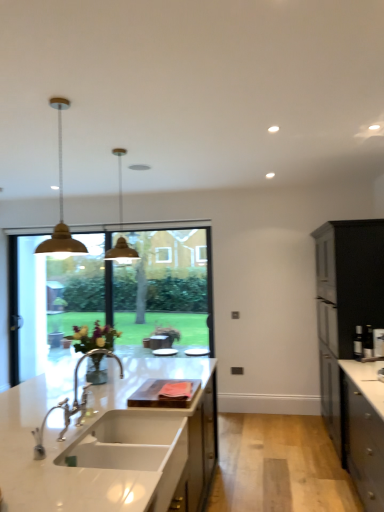
What are the coordinates of `empty space that is ontop of metallic gold pendant light at center (from a real-world perspective)` in the screenshot? It's located at (114, 151).